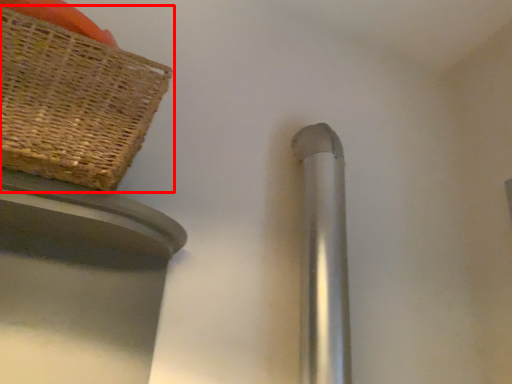
Question: From the image's perspective, what is the correct spatial positioning of picnic basket (annotated by the red box) in reference to door handle?

Choices:
 (A) below
 (B) above

Answer: (B)